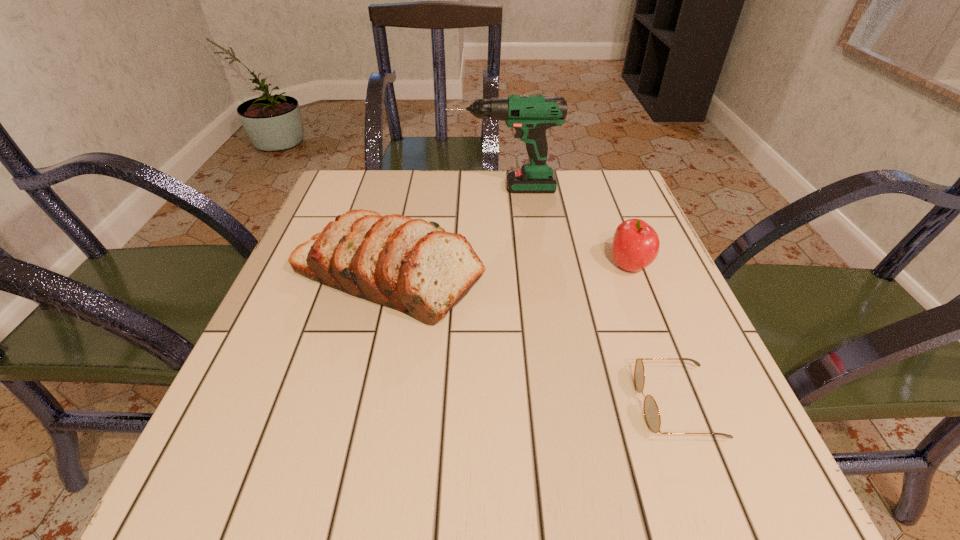
In order to click on the tallest object in this screenshot , I will do `click(530, 115)`.

The width and height of the screenshot is (960, 540). In order to click on drill in this screenshot , I will do `click(530, 115)`.

In order to click on bread in this screenshot , I will do `click(410, 265)`.

I want to click on apple, so click(636, 244).

Where is `the shortest object`? the shortest object is located at coordinates (652, 417).

This screenshot has width=960, height=540. What are the coordinates of `sunglasses` in the screenshot? It's located at (652, 417).

This screenshot has width=960, height=540. Find the location of `free space located 0.100m on the handle side of the drill`. free space located 0.100m on the handle side of the drill is located at coordinates (411, 188).

The width and height of the screenshot is (960, 540). Find the location of `free spot located on the handle side of the drill`. free spot located on the handle side of the drill is located at coordinates (399, 188).

You are a GUI agent. You are given a task and a screenshot of the screen. Output one action in this format:
    pyautogui.click(x=<x>, y=<y>)
    Task: Click on the blank area located on the handle side of the drill
    
    Given the screenshot: What is the action you would take?
    pyautogui.click(x=345, y=188)

At what (x,y) coordinates should I click in order to perform the action: click on vacant space positioned on the front of the bread. Please return your answer as a coordinate pair (x, y). Image resolution: width=960 pixels, height=540 pixels. Looking at the image, I should click on (362, 388).